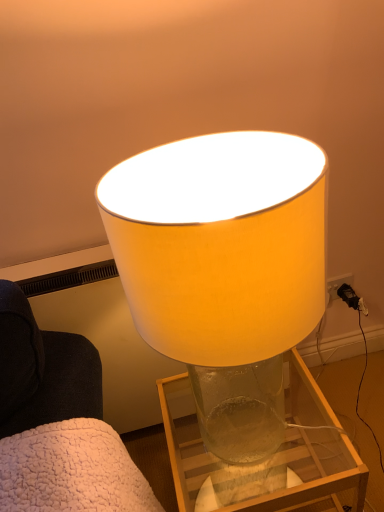
What are the coordinates of `matte white lampshade at center` in the screenshot? It's located at (224, 269).

The height and width of the screenshot is (512, 384). What do you see at coordinates (224, 269) in the screenshot?
I see `matte white lampshade at center` at bounding box center [224, 269].

You are a GUI agent. You are given a task and a screenshot of the screen. Output one action in this format:
    pyautogui.click(x=<x>, y=<y>)
    Task: Click on the matte white lampshade at center
    This screenshot has height=512, width=384.
    Given the screenshot: What is the action you would take?
    pyautogui.click(x=224, y=269)